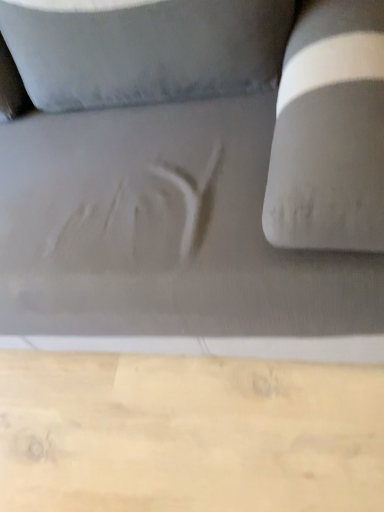
Question: In terms of width, does matte gray fabric couch at center look wider or thinner when compared to wooden plank at lower center?

Choices:
 (A) wide
 (B) thin

Answer: (B)

Question: From their relative heights in the image, would you say matte gray fabric couch at center is taller or shorter than wooden plank at lower center?

Choices:
 (A) tall
 (B) short

Answer: (A)

Question: In terms of size, does matte gray fabric couch at center appear bigger or smaller than wooden plank at lower center?

Choices:
 (A) small
 (B) big

Answer: (B)

Question: In the image, is wooden plank at lower center positioned in front of or behind matte gray fabric couch at center?

Choices:
 (A) front
 (B) behind

Answer: (B)

Question: In terms of width, does wooden plank at lower center look wider or thinner when compared to matte gray fabric couch at center?

Choices:
 (A) wide
 (B) thin

Answer: (A)

Question: Is wooden plank at lower center taller or shorter than matte gray fabric couch at center?

Choices:
 (A) short
 (B) tall

Answer: (A)

Question: Is wooden plank at lower center bigger or smaller than matte gray fabric couch at center?

Choices:
 (A) small
 (B) big

Answer: (A)